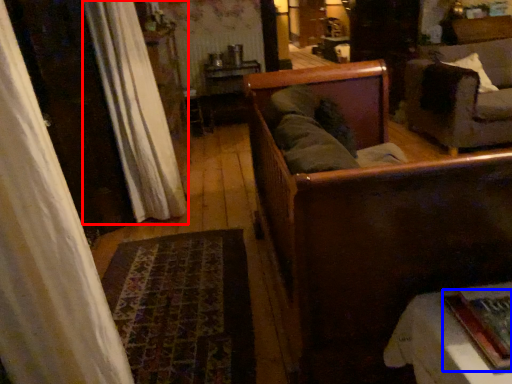
Question: Which object appears farthest to the camera in this image, curtain (highlighted by a red box) or book (highlighted by a blue box)?

Choices:
 (A) curtain
 (B) book

Answer: (A)